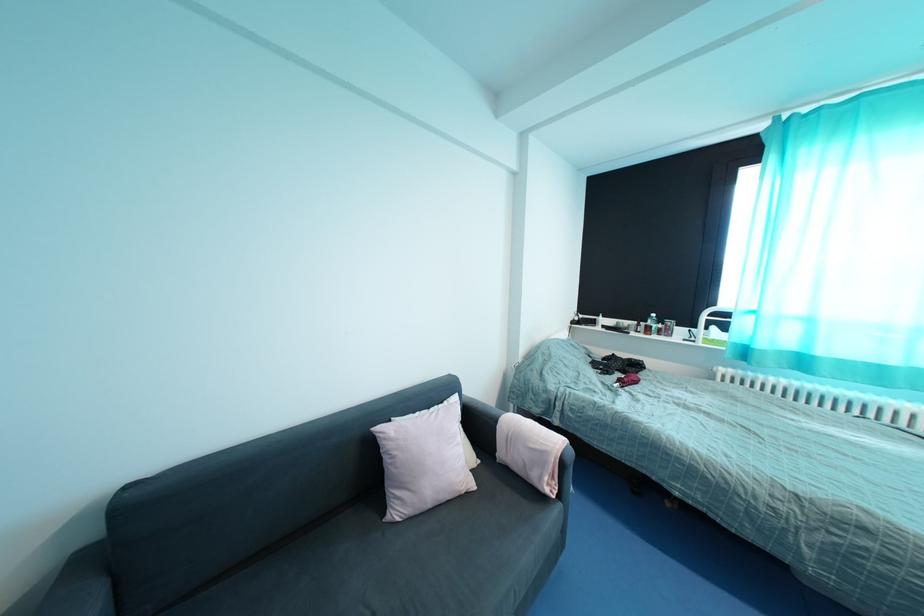
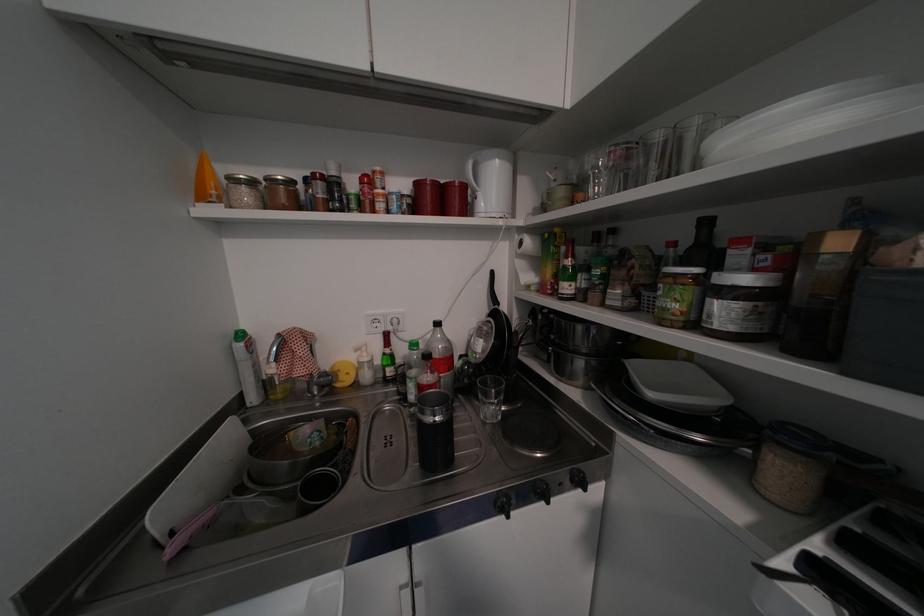
In a continuous first-person perspective shot, in which direction is the camera moving?

The cameraman moved toward left, backward.